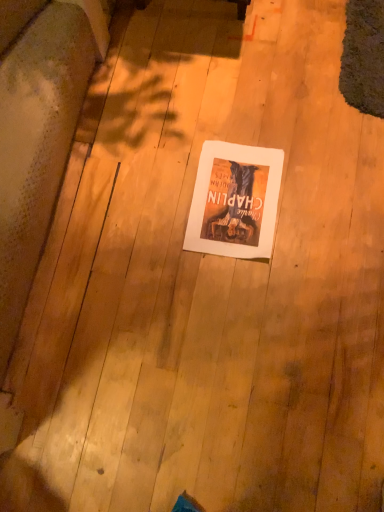
Find the location of a particular element. white paper poster at center is located at coordinates (234, 201).

Describe the element at coordinates (234, 201) in the screenshot. Image resolution: width=384 pixels, height=512 pixels. I see `white paper poster at center` at that location.

At what (x,y) coordinates should I click in order to perform the action: click on white paper poster at center. Please return your answer as a coordinate pair (x, y). The image size is (384, 512). Looking at the image, I should click on [x=234, y=201].